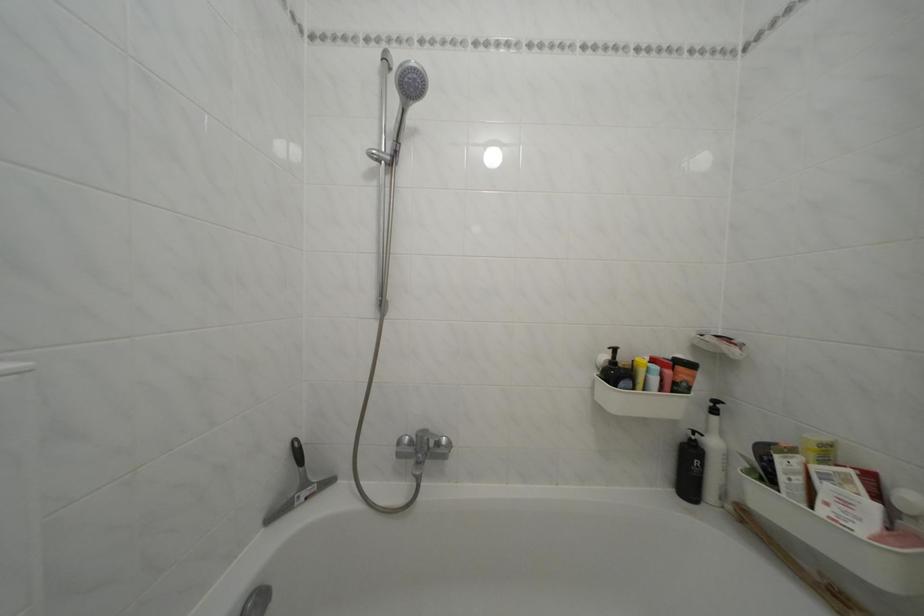
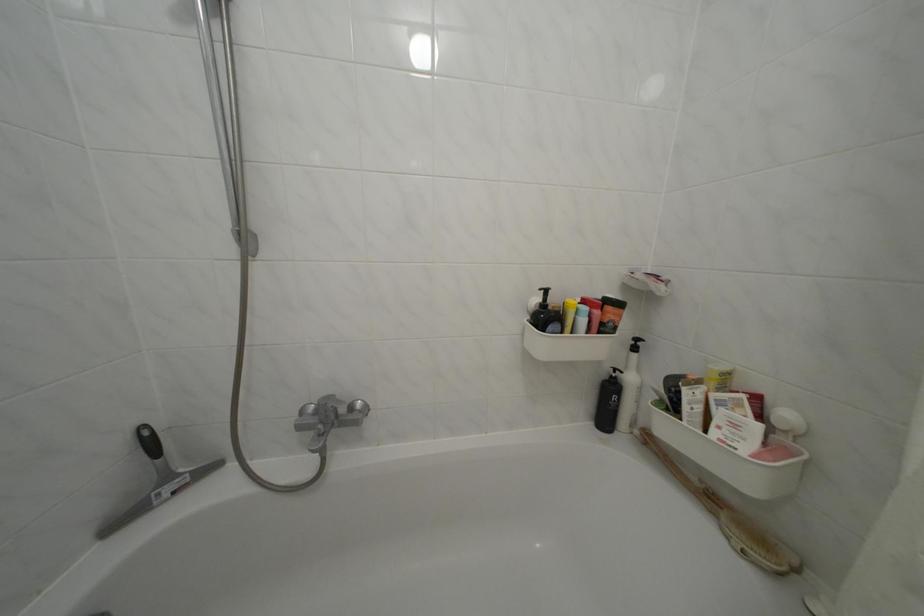
In the second image, find the point that corresponds to (420,456) in the first image.

(323, 426)